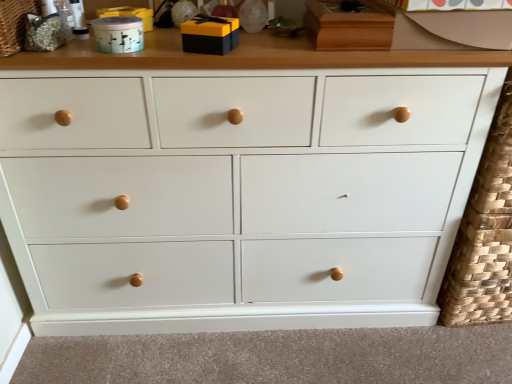
Where is `matte black gift box at upper center, acting as the second toy starting from the left`? The image size is (512, 384). matte black gift box at upper center, acting as the second toy starting from the left is located at coordinates (210, 35).

This screenshot has width=512, height=384. What do you see at coordinates (118, 34) in the screenshot?
I see `matte teal ceramic container at upper left, placed as the second toy when sorted from right to left` at bounding box center [118, 34].

Where is `matte teal ceramic container at upper left, placed as the second toy when sorted from right to left`? The image size is (512, 384). matte teal ceramic container at upper left, placed as the second toy when sorted from right to left is located at coordinates (118, 34).

Image resolution: width=512 pixels, height=384 pixels. Identify the location of textured woven basket at upper left. (15, 24).

Can you confirm if white painted wood chest of drawers at center is bigger than matte teal ceramic container at upper left, acting as the first toy starting from the left?

Yes, white painted wood chest of drawers at center is bigger than matte teal ceramic container at upper left, acting as the first toy starting from the left.

From a real-world perspective, which is physically above, white painted wood chest of drawers at center or matte teal ceramic container at upper left, acting as the first toy starting from the left?

In real-world perspective, matte teal ceramic container at upper left, acting as the first toy starting from the left, is above.

Is white painted wood chest of drawers at center located outside matte teal ceramic container at upper left, acting as the first toy starting from the left?

Yes, white painted wood chest of drawers at center is located beyond the bounds of matte teal ceramic container at upper left, acting as the first toy starting from the left.

Can you confirm if white painted wood chest of drawers at center is smaller than matte black gift box at upper center, which appears as the 1th toy when viewed from the right?

No, white painted wood chest of drawers at center is not smaller than matte black gift box at upper center, which appears as the 1th toy when viewed from the right.

From the picture: Considering the relative positions of white painted wood chest of drawers at center and matte black gift box at upper center, acting as the second toy starting from the left, in the image provided, is white painted wood chest of drawers at center to the right of matte black gift box at upper center, acting as the second toy starting from the left, from the viewer's perspective?

Yes, white painted wood chest of drawers at center is to the right of matte black gift box at upper center, acting as the second toy starting from the left.

Considering the positions of objects white painted wood chest of drawers at center and matte black gift box at upper center, which appears as the 1th toy when viewed from the right, in the image provided, who is behind, white painted wood chest of drawers at center or matte black gift box at upper center, which appears as the 1th toy when viewed from the right,?

Positioned behind is white painted wood chest of drawers at center.

Is white painted wood chest of drawers at center far from matte black gift box at upper center, which appears as the 1th toy when viewed from the right?

No.

Is matte black gift box at upper center, which appears as the 1th toy when viewed from the right, at the left side of matte teal ceramic container at upper left, placed as the second toy when sorted from right to left?

Incorrect, matte black gift box at upper center, which appears as the 1th toy when viewed from the right, is not on the left side of matte teal ceramic container at upper left, placed as the second toy when sorted from right to left.

I want to click on toy that is below the matte black gift box at upper center, acting as the second toy starting from the left (from the image's perspective), so click(118, 34).

Between matte black gift box at upper center, acting as the second toy starting from the left, and matte teal ceramic container at upper left, acting as the first toy starting from the left, which one has smaller size?

matte teal ceramic container at upper left, acting as the first toy starting from the left, is smaller.

Which object is positioned more to the right, white painted wood chest of drawers at center or textured woven basket at upper left?

white painted wood chest of drawers at center.

Is white painted wood chest of drawers at center wider than textured woven basket at upper left?

Correct, the width of white painted wood chest of drawers at center exceeds that of textured woven basket at upper left.

How many degrees apart are the facing directions of white painted wood chest of drawers at center and textured woven basket at upper left?

The angle between the facing direction of white painted wood chest of drawers at center and the facing direction of textured woven basket at upper left is 3.09 degrees.

From the image's perspective, which one is positioned higher, white painted wood chest of drawers at center or textured woven basket at upper left?

textured woven basket at upper left, from the image's perspective.

Considering their positions, is matte black gift box at upper center, acting as the second toy starting from the left, located in front of or behind textured woven basket at upper left?

In the image, matte black gift box at upper center, acting as the second toy starting from the left, appears behind textured woven basket at upper left.

Based on the photo, is matte black gift box at upper center, acting as the second toy starting from the left, to the right of textured woven basket at upper left from the viewer's perspective?

Correct, you'll find matte black gift box at upper center, acting as the second toy starting from the left, to the right of textured woven basket at upper left.

Can you confirm if matte black gift box at upper center, acting as the second toy starting from the left, is bigger than textured woven basket at upper left?

No, matte black gift box at upper center, acting as the second toy starting from the left, is not bigger than textured woven basket at upper left.

How many degrees apart are the facing directions of matte black gift box at upper center, acting as the second toy starting from the left, and textured woven basket at upper left?

The facing directions of matte black gift box at upper center, acting as the second toy starting from the left, and textured woven basket at upper left are 16.6 degrees apart.

Is textured woven basket at upper left turned away from matte teal ceramic container at upper left, acting as the first toy starting from the left?

That's not correct — textured woven basket at upper left is not looking away from matte teal ceramic container at upper left, acting as the first toy starting from the left.

The image size is (512, 384). I want to click on basket lying above the matte teal ceramic container at upper left, acting as the first toy starting from the left (from the image's perspective), so click(15, 24).

Measure the distance from textured woven basket at upper left to matte teal ceramic container at upper left, acting as the first toy starting from the left.

A distance of 7.60 inches exists between textured woven basket at upper left and matte teal ceramic container at upper left, acting as the first toy starting from the left.

Which is behind, textured woven basket at upper left or matte teal ceramic container at upper left, acting as the first toy starting from the left?

Positioned behind is matte teal ceramic container at upper left, acting as the first toy starting from the left.

Considering the relative sizes of matte teal ceramic container at upper left, placed as the second toy when sorted from right to left, and matte black gift box at upper center, which appears as the 1th toy when viewed from the right, in the image provided, is matte teal ceramic container at upper left, placed as the second toy when sorted from right to left, taller than matte black gift box at upper center, which appears as the 1th toy when viewed from the right,?

Incorrect, the height of matte teal ceramic container at upper left, placed as the second toy when sorted from right to left, is not larger of that of matte black gift box at upper center, which appears as the 1th toy when viewed from the right.

How different are the orientations of matte teal ceramic container at upper left, acting as the first toy starting from the left, and matte black gift box at upper center, which appears as the 1th toy when viewed from the right, in degrees?

The angle between the facing direction of matte teal ceramic container at upper left, acting as the first toy starting from the left, and the facing direction of matte black gift box at upper center, which appears as the 1th toy when viewed from the right, is 19.1 degrees.

Considering the positions of point (124, 33) and point (231, 40), is point (124, 33) closer or farther from the camera than point (231, 40)?

Point (124, 33) is positioned closer to the camera compared to point (231, 40).

Where is `toy lying above the matte teal ceramic container at upper left, placed as the second toy when sorted from right to left (from the image's perspective)`? This screenshot has height=384, width=512. toy lying above the matte teal ceramic container at upper left, placed as the second toy when sorted from right to left (from the image's perspective) is located at coordinates (210, 35).

Where is `toy that is the 1st object above the white painted wood chest of drawers at center (from a real-world perspective)`? This screenshot has height=384, width=512. toy that is the 1st object above the white painted wood chest of drawers at center (from a real-world perspective) is located at coordinates (118, 34).

Find the location of a particular element. This screenshot has height=384, width=512. chest of drawers behind the matte black gift box at upper center, acting as the second toy starting from the left is located at coordinates (238, 195).

Based on their spatial positions, is matte black gift box at upper center, which appears as the 1th toy when viewed from the right, or white painted wood chest of drawers at center closer to matte teal ceramic container at upper left, placed as the second toy when sorted from right to left?

matte black gift box at upper center, which appears as the 1th toy when viewed from the right, is closer to matte teal ceramic container at upper left, placed as the second toy when sorted from right to left.

When comparing their distances from textured woven basket at upper left, does matte black gift box at upper center, acting as the second toy starting from the left, or matte teal ceramic container at upper left, acting as the first toy starting from the left, seem closer?

matte teal ceramic container at upper left, acting as the first toy starting from the left, lies closer to textured woven basket at upper left than the other object.

Based on their spatial positions, is white painted wood chest of drawers at center or matte teal ceramic container at upper left, acting as the first toy starting from the left, further from textured woven basket at upper left?

white painted wood chest of drawers at center.

Looking at the image, which one is located closer to matte teal ceramic container at upper left, placed as the second toy when sorted from right to left, white painted wood chest of drawers at center or matte black gift box at upper center, acting as the second toy starting from the left?

Among the two, matte black gift box at upper center, acting as the second toy starting from the left, is located nearer to matte teal ceramic container at upper left, placed as the second toy when sorted from right to left.

Considering their positions, is matte teal ceramic container at upper left, acting as the first toy starting from the left, positioned closer to matte black gift box at upper center, acting as the second toy starting from the left, than textured woven basket at upper left?

matte teal ceramic container at upper left, acting as the first toy starting from the left, lies closer to matte black gift box at upper center, acting as the second toy starting from the left, than the other object.

Which object lies further to the anchor point matte teal ceramic container at upper left, placed as the second toy when sorted from right to left, white painted wood chest of drawers at center or textured woven basket at upper left?

white painted wood chest of drawers at center is further to matte teal ceramic container at upper left, placed as the second toy when sorted from right to left.

In the scene shown: From the image, which object appears to be nearer to white painted wood chest of drawers at center, matte black gift box at upper center, which appears as the 1th toy when viewed from the right, or matte teal ceramic container at upper left, placed as the second toy when sorted from right to left?

matte black gift box at upper center, which appears as the 1th toy when viewed from the right.

Consider the image. Estimate the real-world distances between objects in this image. Which object is further from matte black gift box at upper center, which appears as the 1th toy when viewed from the right, textured woven basket at upper left or white painted wood chest of drawers at center?

white painted wood chest of drawers at center.

Locate an element on the screen. toy that lies between matte black gift box at upper center, acting as the second toy starting from the left, and white painted wood chest of drawers at center from top to bottom is located at coordinates (118, 34).

Identify the location of toy situated between textured woven basket at upper left and matte black gift box at upper center, acting as the second toy starting from the left, from left to right. (118, 34).